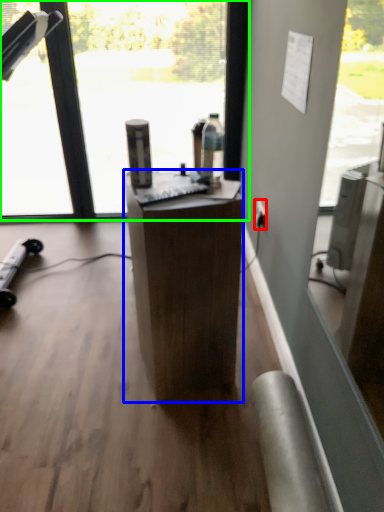
Question: Considering the real-world distances, which object is farthest from power outlet (highlighted by a red box)? desk (highlighted by a blue box) or window (highlighted by a green box)?

Choices:
 (A) desk
 (B) window

Answer: (B)